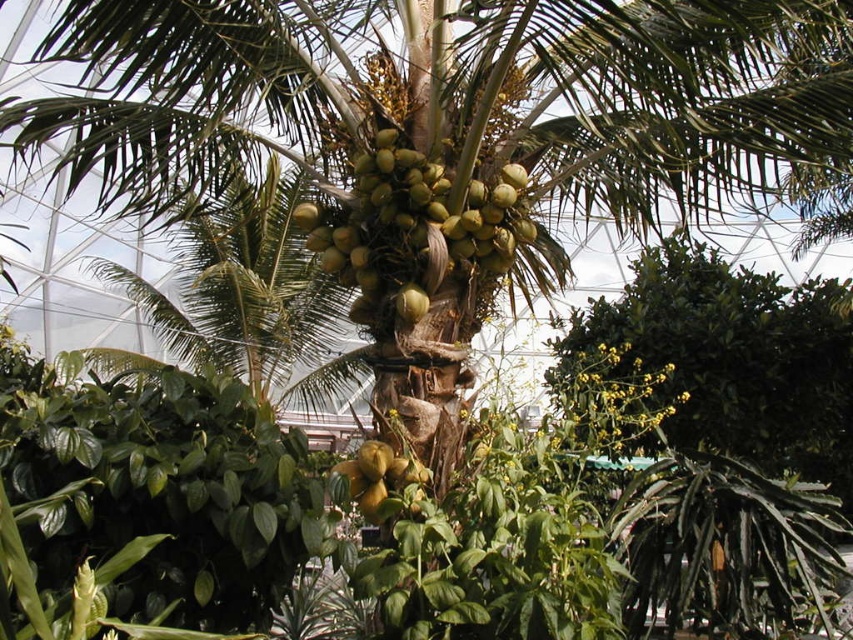
Who is more distant from viewer, (463,234) or (422,472)?

The point (463,234) is more distant.

Does green matte coconuts at center have a greater width compared to green matte coconut at center?

Yes, green matte coconuts at center is wider than green matte coconut at center.

Does point (404, 298) lie in front of point (425, 481)?

No, it is behind (425, 481).

Locate an element on the screen. green matte coconuts at center is located at coordinates pyautogui.click(x=415, y=227).